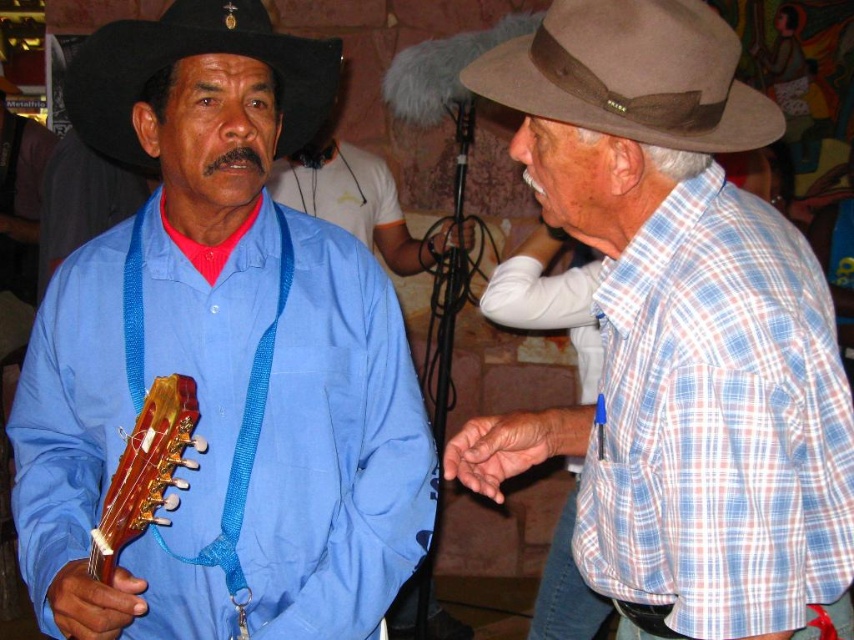
Is blue woven shirt at center taller than wooden acoustic guitar at left?

Yes.

Can you confirm if blue woven shirt at center is shorter than wooden acoustic guitar at left?

No, blue woven shirt at center is not shorter than wooden acoustic guitar at left.

Measure the distance between blue woven shirt at center and camera.

They are 38.08 inches apart.

Find the location of `blue woven shirt at center`. blue woven shirt at center is located at coordinates (677, 332).

Is brown felt fedora at upper right thinner than wooden acoustic guitar at left?

No, brown felt fedora at upper right is not thinner than wooden acoustic guitar at left.

Who is more forward, (607, 106) or (196, 436)?

Positioned in front is point (607, 106).

Describe the element at coordinates (632, 76) in the screenshot. I see `brown felt fedora at upper right` at that location.

Identify the location of brown felt fedora at upper right. This screenshot has width=854, height=640. (632, 76).

Is the position of black felt fedora at upper left less distant than that of wooden acoustic guitar at left?

No, black felt fedora at upper left is behind wooden acoustic guitar at left.

Which is behind, point (325, 100) or point (190, 417)?

Point (325, 100)

Who is more forward, (325, 99) or (127, 440)?

Point (127, 440)

Where is `black felt fedora at upper left`? black felt fedora at upper left is located at coordinates (190, 54).